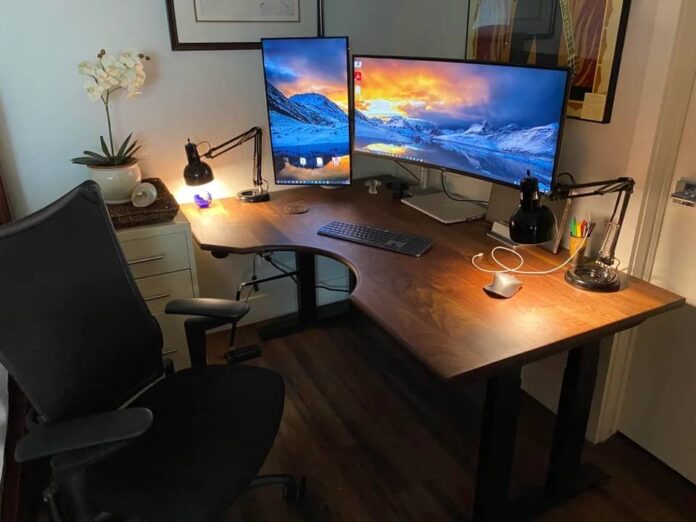
Find the location of `chair`. chair is located at coordinates (111, 319).